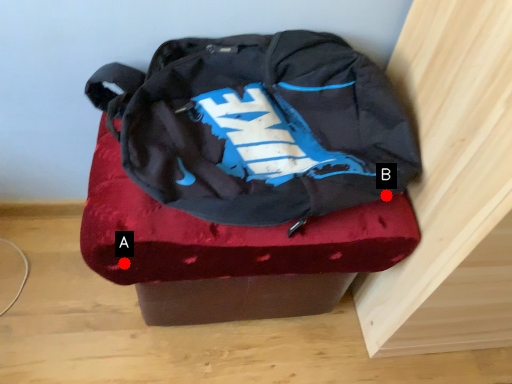
Question: Two points are circled on the image, labeled by A and B beside each circle. Which point is farther to the camera?

Choices:
 (A) A is further
 (B) B is further

Answer: (B)